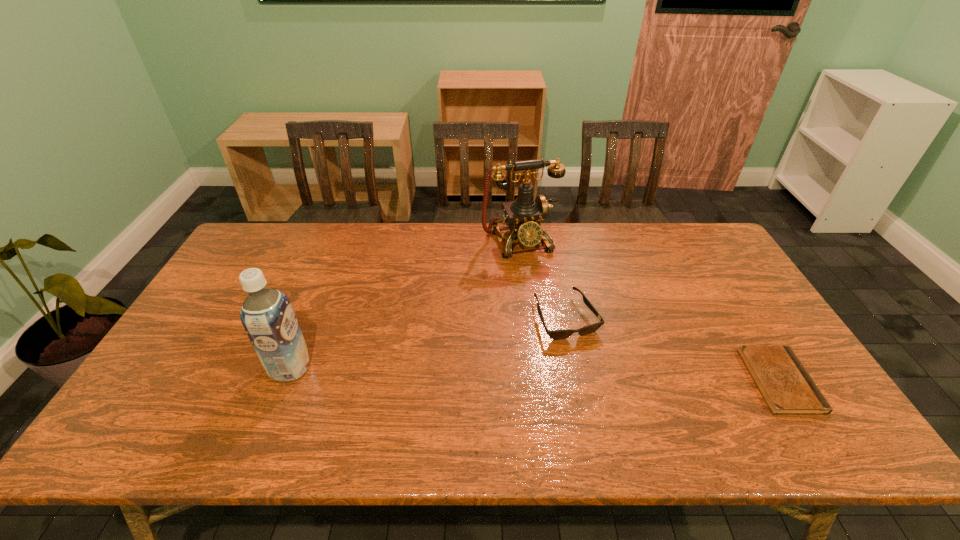
This screenshot has height=540, width=960. What are the coordinates of `vacant space on the desktop that is between the soya milk and the rightmost object and is positioned on the front of the telephone, featuring the rotary dial` in the screenshot? It's located at (586, 376).

Where is `vacant spot on the desktop that is between the leftmost object and the diary and is positioned on the front-facing side of the second shortest object`? The image size is (960, 540). vacant spot on the desktop that is between the leftmost object and the diary and is positioned on the front-facing side of the second shortest object is located at coordinates (597, 376).